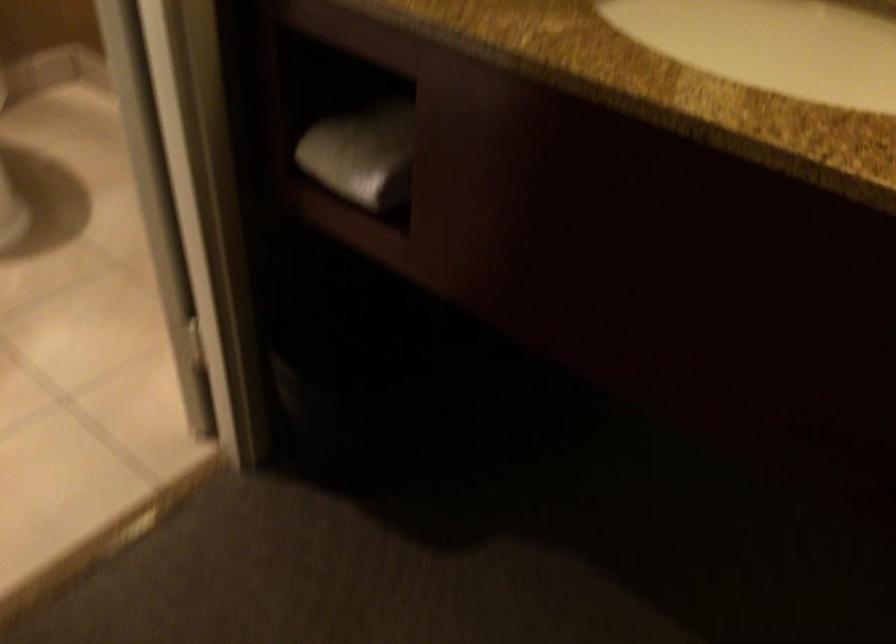
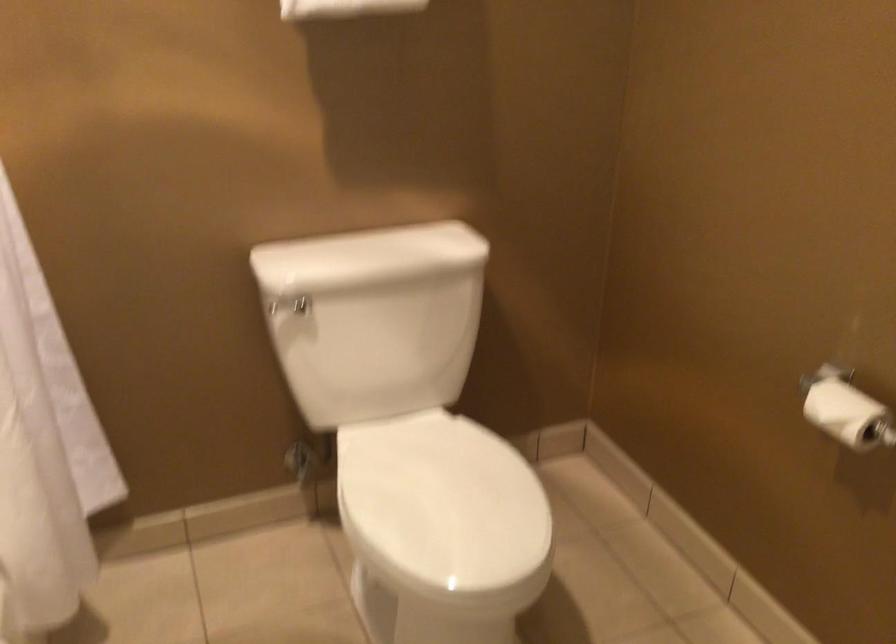
Question: Based on the continuous images, in which direction is the camera rotating? Reply with the corresponding letter.

Choices:
 (A) Left
 (B) Right
 (C) Up
 (D) Down

Answer: (A)